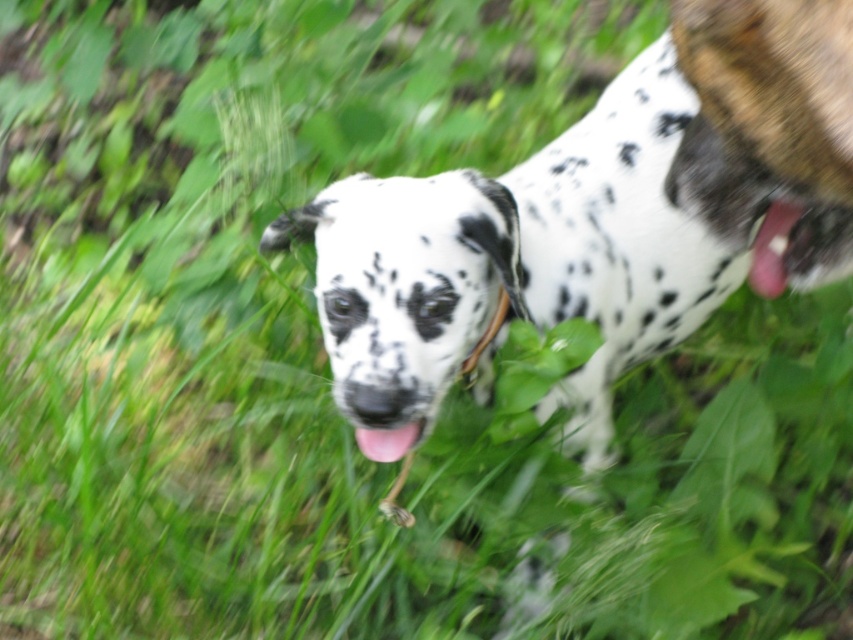
Question: Does white-spotted fur dog at center appear over black leather collar at center?

Choices:
 (A) yes
 (B) no

Answer: (A)

Question: Which object appears farthest from the camera in this image?

Choices:
 (A) white-spotted fur dog at center
 (B) pink glossy tongue at center
 (C) pink leather tongue at center

Answer: (B)

Question: Is pink glossy tongue at center positioned in front of black leather collar at center?

Choices:
 (A) no
 (B) yes

Answer: (B)

Question: Which of the following is the closest to the observer?

Choices:
 (A) pink leather tongue at center
 (B) pink glossy tongue at center
 (C) white-spotted fur dog at center

Answer: (A)

Question: Is white-spotted fur dog at center bigger than black leather collar at center?

Choices:
 (A) yes
 (B) no

Answer: (A)

Question: Which object is closer to the camera taking this photo?

Choices:
 (A) pink leather tongue at center
 (B) black leather collar at center
 (C) white-spotted fur dog at center
 (D) pink glossy tongue at center

Answer: (A)